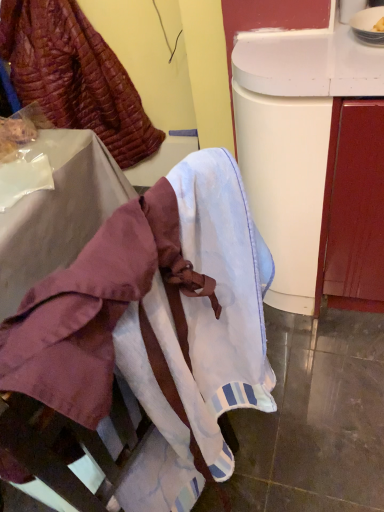
Question: Should I look upward or downward to see white cotton towel at lower center?

Choices:
 (A) down
 (B) up

Answer: (A)

Question: Can you see velvet-like burgundy fabric at upper left touching white cotton towel at lower center?

Choices:
 (A) no
 (B) yes

Answer: (A)

Question: Is velvet-like burgundy fabric at upper left positioned with its back to white cotton towel at lower center?

Choices:
 (A) no
 (B) yes

Answer: (A)

Question: Are velvet-like burgundy fabric at upper left and white cotton towel at lower center located far from each other?

Choices:
 (A) no
 (B) yes

Answer: (B)

Question: Can you confirm if velvet-like burgundy fabric at upper left is smaller than white cotton towel at lower center?

Choices:
 (A) yes
 (B) no

Answer: (B)

Question: Can you confirm if velvet-like burgundy fabric at upper left is taller than white cotton towel at lower center?

Choices:
 (A) no
 (B) yes

Answer: (B)

Question: From the image's perspective, is velvet-like burgundy fabric at upper left on top of white cotton towel at lower center?

Choices:
 (A) yes
 (B) no

Answer: (A)

Question: From a real-world perspective, is white cotton towel at lower center beneath velvet-like burgundy fabric at upper left?

Choices:
 (A) no
 (B) yes

Answer: (A)

Question: Is the depth of white cotton towel at lower center greater than that of velvet-like burgundy fabric at upper left?

Choices:
 (A) yes
 (B) no

Answer: (B)

Question: Considering the relative positions of white cotton towel at lower center and velvet-like burgundy fabric at upper left in the image provided, is white cotton towel at lower center to the left of velvet-like burgundy fabric at upper left from the viewer's perspective?

Choices:
 (A) yes
 (B) no

Answer: (B)

Question: Would you say white cotton towel at lower center is a long distance from velvet-like burgundy fabric at upper left?

Choices:
 (A) yes
 (B) no

Answer: (A)

Question: Can you confirm if white cotton towel at lower center is smaller than velvet-like burgundy fabric at upper left?

Choices:
 (A) no
 (B) yes

Answer: (B)

Question: Is velvet-like burgundy fabric at upper left at the back of white cotton towel at lower center?

Choices:
 (A) no
 (B) yes

Answer: (A)

Question: From their relative heights in the image, would you say velvet-like burgundy fabric at upper left is taller or shorter than white cotton towel at lower center?

Choices:
 (A) tall
 (B) short

Answer: (A)